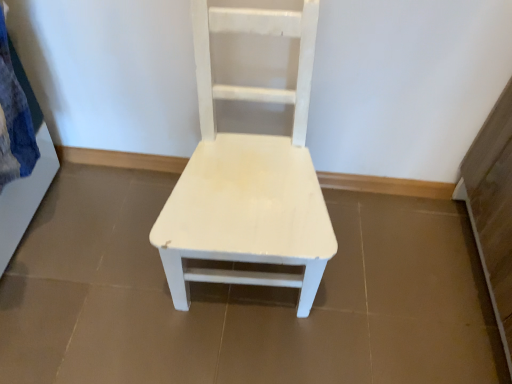
In order to face white painted wood chair at center, should I rotate leftwards or rightwards?

Rotate left and turn 0.165 degrees.

Image resolution: width=512 pixels, height=384 pixels. What are the coordinates of `white painted wood chair at center` in the screenshot? It's located at [x=248, y=175].

This screenshot has width=512, height=384. Describe the element at coordinates (248, 175) in the screenshot. I see `white painted wood chair at center` at that location.

The height and width of the screenshot is (384, 512). I want to click on white painted wood chair at center, so click(x=248, y=175).